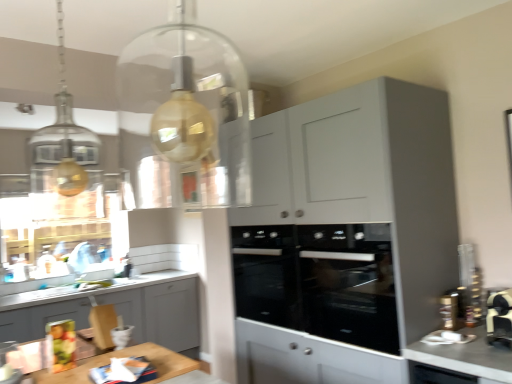
Question: In terms of height, does white glossy countertop at lower right look taller or shorter compared to matte gray cabinet at lower left, which ranks as the 2th cabinetry in right-to-left order?

Choices:
 (A) short
 (B) tall

Answer: (A)

Question: Choose the correct answer: Is white glossy countertop at lower right inside matte gray cabinet at lower left, the 1th cabinetry when ordered from back to front, or outside it?

Choices:
 (A) inside
 (B) outside

Answer: (B)

Question: Considering the real-world distances, which object is farthest from the matte gray cabinet at upper right, the 1th cabinetry from the front?

Choices:
 (A) black glass oven at center
 (B) matte gray cabinet at lower left, arranged as the second cabinetry when viewed from the front
 (C) black glass oven at center
 (D) white glossy countertop at lower right

Answer: (B)

Question: Which object is positioned farthest from the white glossy countertop at lower right?

Choices:
 (A) black glass oven at center
 (B) black glass oven at center
 (C) matte gray cabinet at lower left, which ranks as the 2th cabinetry in right-to-left order
 (D) matte gray cabinet at upper right, which is the first cabinetry in right-to-left order

Answer: (C)